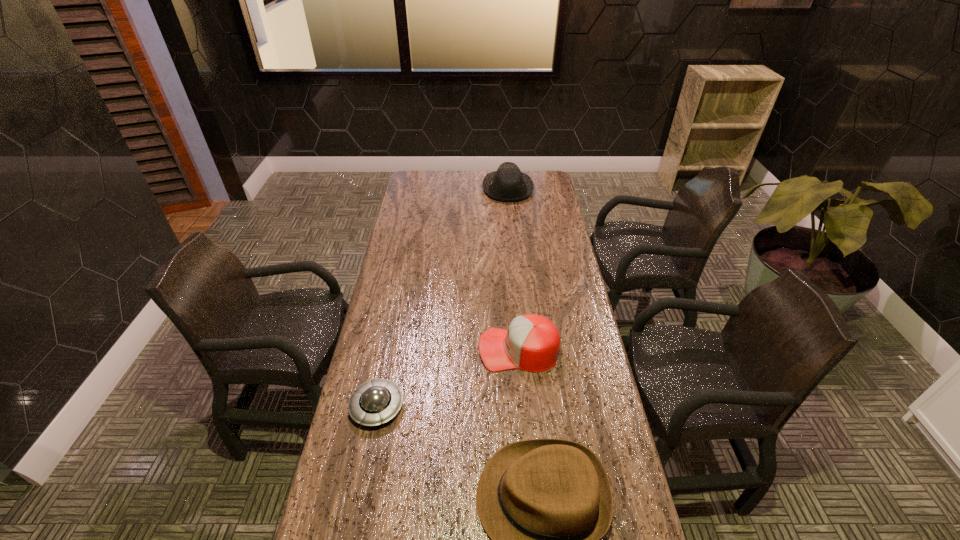
Find the location of a particular element. The image size is (960, 540). the farthest object is located at coordinates (508, 184).

At what (x,y) coordinates should I click in order to perform the action: click on baseball cap. Please return your answer as a coordinate pair (x, y). Looking at the image, I should click on (532, 342).

The height and width of the screenshot is (540, 960). I want to click on the shortest object, so click(375, 402).

The width and height of the screenshot is (960, 540). Find the location of `the second nearest object`. the second nearest object is located at coordinates (375, 402).

I want to click on blank space located 0.310m on the front-facing side of the farthest object, so click(x=420, y=188).

Locate an element on the screen. vacant space situated on the front-facing side of the farthest object is located at coordinates (407, 188).

I want to click on free region located 0.100m on the front-facing side of the farthest object, so click(463, 188).

Locate an element on the screen. The image size is (960, 540). vacant space located on the front-facing side of the third nearest object is located at coordinates (365, 349).

Find the location of a particular element. vacant space located 0.360m on the front-facing side of the third nearest object is located at coordinates (368, 349).

I want to click on vacant space positioned 0.060m on the front-facing side of the third nearest object, so click(x=460, y=349).